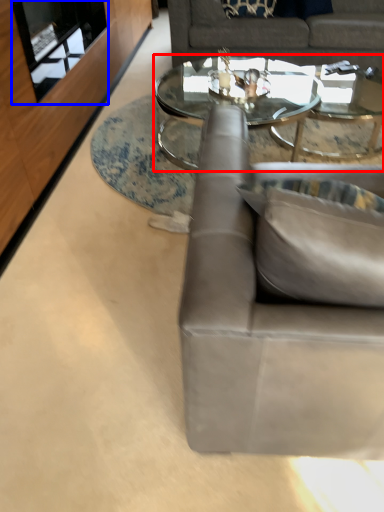
Question: Which object is closer to the camera taking this photo, coffee table (highlighted by a red box) or glass door (highlighted by a blue box)?

Choices:
 (A) coffee table
 (B) glass door

Answer: (B)